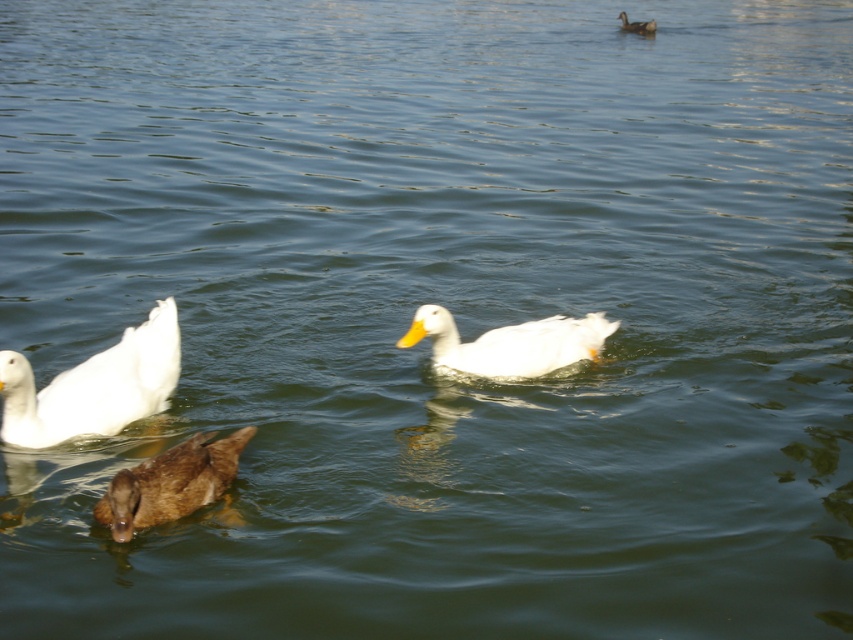
You are standing on the lakeshore and see two white ducks in the water. The white matte duck at lower left and the white matte duck at upper right. Which duck is positioned more to the left side of the scene?

The white matte duck at lower left is positioned more to the left side of the scene than the white matte duck at upper right.

You are a photographer trying to capture the white matte duck at center and the brown matte duck at center in the same frame. Based on their positions, which duck is closer to the surface of the water?

The white matte duck at center is positioned over the brown matte duck at center, so it is closer to the surface of the water.